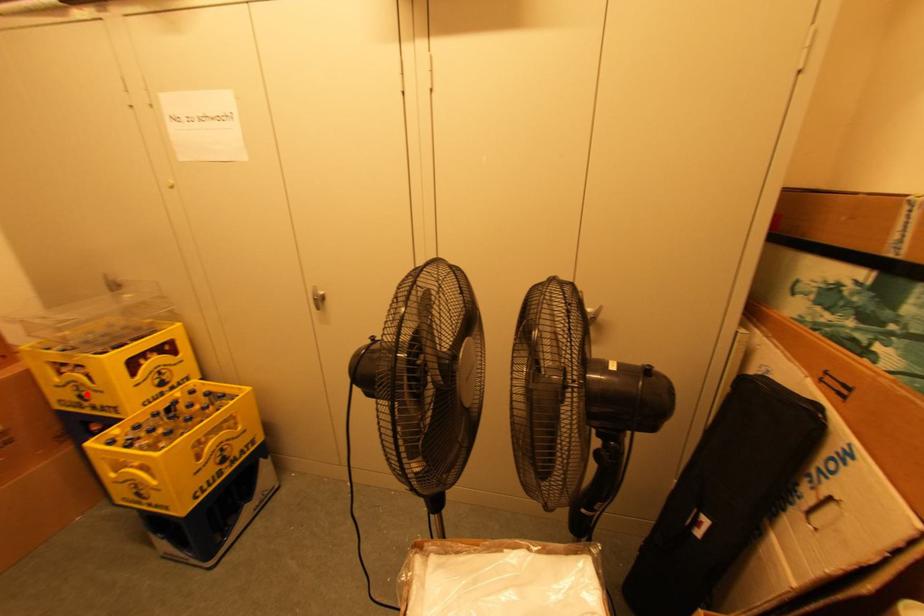
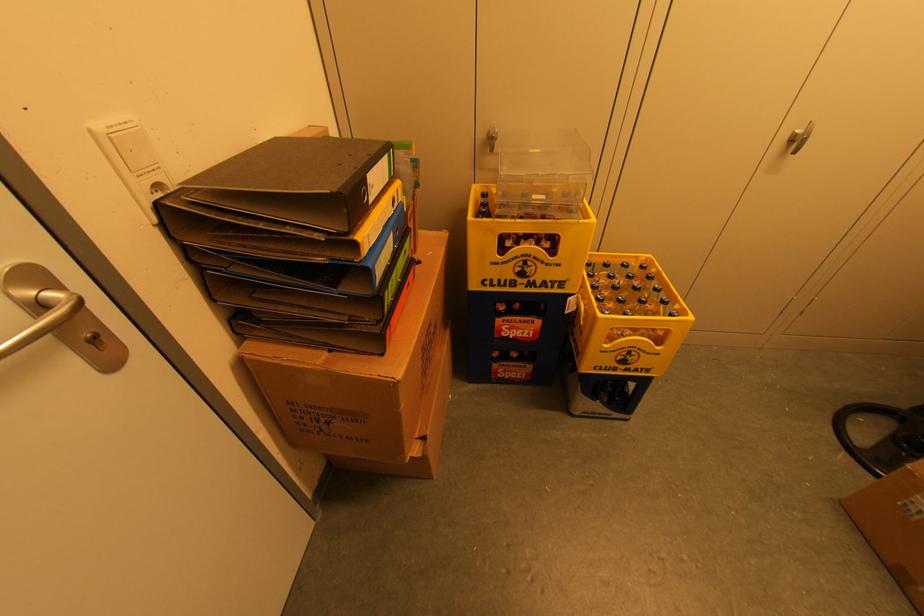
In the second image, find the point that corresponds to the highlighted location in the first image.

(530, 270)